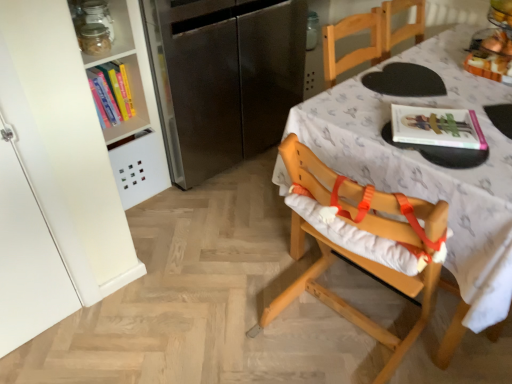
Question: Considering the relative positions of wooden highchair at center and translucent glass bowl at upper right in the image provided, is wooden highchair at center to the right of translucent glass bowl at upper right from the viewer's perspective?

Choices:
 (A) no
 (B) yes

Answer: (A)

Question: Is translucent glass bowl at upper right a part of wooden highchair at center?

Choices:
 (A) no
 (B) yes

Answer: (A)

Question: Can you confirm if wooden highchair at center is shorter than translucent glass bowl at upper right?

Choices:
 (A) yes
 (B) no

Answer: (B)

Question: From the image's perspective, is wooden highchair at center located beneath translucent glass bowl at upper right?

Choices:
 (A) yes
 (B) no

Answer: (A)

Question: Could you tell me if wooden highchair at center is turned towards translucent glass bowl at upper right?

Choices:
 (A) no
 (B) yes

Answer: (B)

Question: From a real-world perspective, relative to clear glass jar at upper left, is matte pink magazine at upper right vertically above or below?

Choices:
 (A) above
 (B) below

Answer: (B)

Question: Considering the relative positions of matte pink magazine at upper right and clear glass jar at upper left in the image provided, is matte pink magazine at upper right to the left or to the right of clear glass jar at upper left?

Choices:
 (A) right
 (B) left

Answer: (A)

Question: Relative to clear glass jar at upper left, is matte pink magazine at upper right in front or behind?

Choices:
 (A) front
 (B) behind

Answer: (A)

Question: Is matte pink magazine at upper right bigger or smaller than clear glass jar at upper left?

Choices:
 (A) big
 (B) small

Answer: (B)

Question: Considering the positions of point (126, 11) and point (504, 69), is point (126, 11) closer or farther from the camera than point (504, 69)?

Choices:
 (A) closer
 (B) farther

Answer: (B)

Question: Considering the positions of clear glass jar at upper left and translucent glass bowl at upper right in the image, is clear glass jar at upper left bigger or smaller than translucent glass bowl at upper right?

Choices:
 (A) big
 (B) small

Answer: (B)

Question: Based on their positions, is clear glass jar at upper left located to the left or right of translucent glass bowl at upper right?

Choices:
 (A) left
 (B) right

Answer: (A)

Question: Is clear glass jar at upper left in front of or behind translucent glass bowl at upper right in the image?

Choices:
 (A) front
 (B) behind

Answer: (B)

Question: From a real-world perspective, relative to wooden table at center, is clear glass jar at upper left vertically above or below?

Choices:
 (A) above
 (B) below

Answer: (A)

Question: Considering their positions, is clear glass jar at upper left located in front of or behind wooden table at center?

Choices:
 (A) front
 (B) behind

Answer: (B)